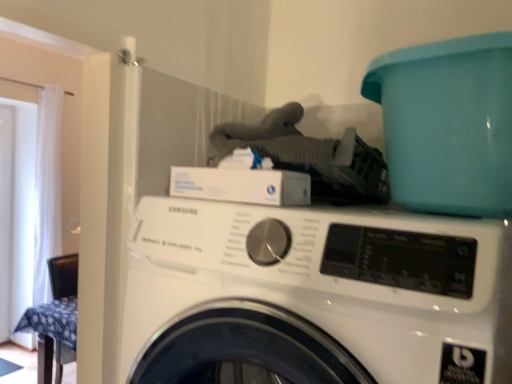
Question: Is teal plastic bucket at upper right next to white sheer curtain at left and touching it?

Choices:
 (A) no
 (B) yes

Answer: (A)

Question: Is teal plastic bucket at upper right in front of white sheer curtain at left?

Choices:
 (A) yes
 (B) no

Answer: (A)

Question: From a real-world perspective, is teal plastic bucket at upper right located beneath white sheer curtain at left?

Choices:
 (A) no
 (B) yes

Answer: (A)

Question: From the image's perspective, is teal plastic bucket at upper right above white sheer curtain at left?

Choices:
 (A) yes
 (B) no

Answer: (A)

Question: Is teal plastic bucket at upper right wider than white sheer curtain at left?

Choices:
 (A) no
 (B) yes

Answer: (B)

Question: Is teal plastic bucket at upper right not within white sheer curtain at left?

Choices:
 (A) yes
 (B) no

Answer: (A)

Question: Does white glossy washing machine at center lie in front of teal plastic bucket at upper right?

Choices:
 (A) no
 (B) yes

Answer: (B)

Question: Can we say white glossy washing machine at center lies outside teal plastic bucket at upper right?

Choices:
 (A) yes
 (B) no

Answer: (A)

Question: Is white glossy washing machine at center aimed at teal plastic bucket at upper right?

Choices:
 (A) yes
 (B) no

Answer: (B)

Question: Is white glossy washing machine at center looking in the opposite direction of teal plastic bucket at upper right?

Choices:
 (A) no
 (B) yes

Answer: (A)

Question: From a real-world perspective, is white glossy washing machine at center physically below teal plastic bucket at upper right?

Choices:
 (A) yes
 (B) no

Answer: (A)

Question: Can you confirm if white glossy washing machine at center is smaller than teal plastic bucket at upper right?

Choices:
 (A) no
 (B) yes

Answer: (A)

Question: Does white sheer curtain at left come behind teal plastic bucket at upper right?

Choices:
 (A) no
 (B) yes

Answer: (B)